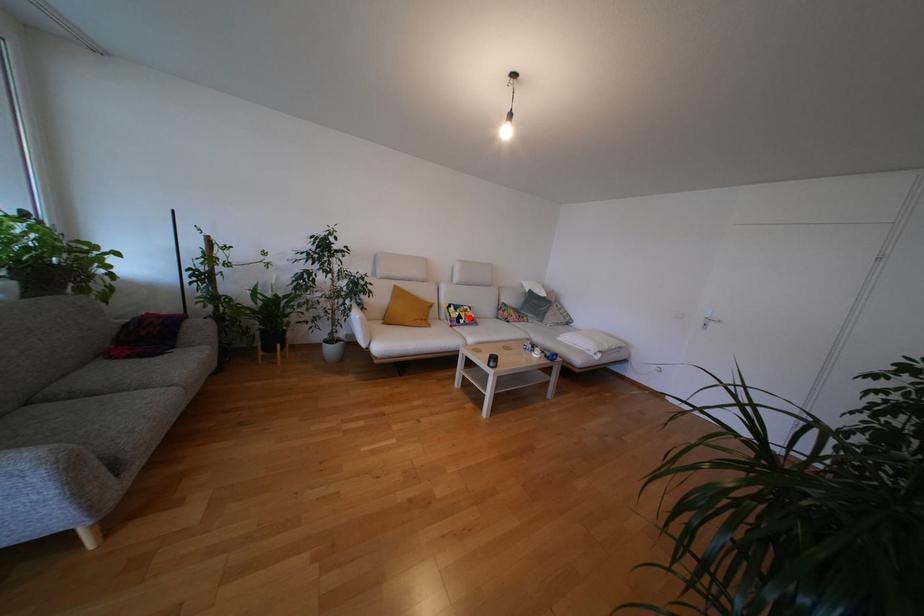
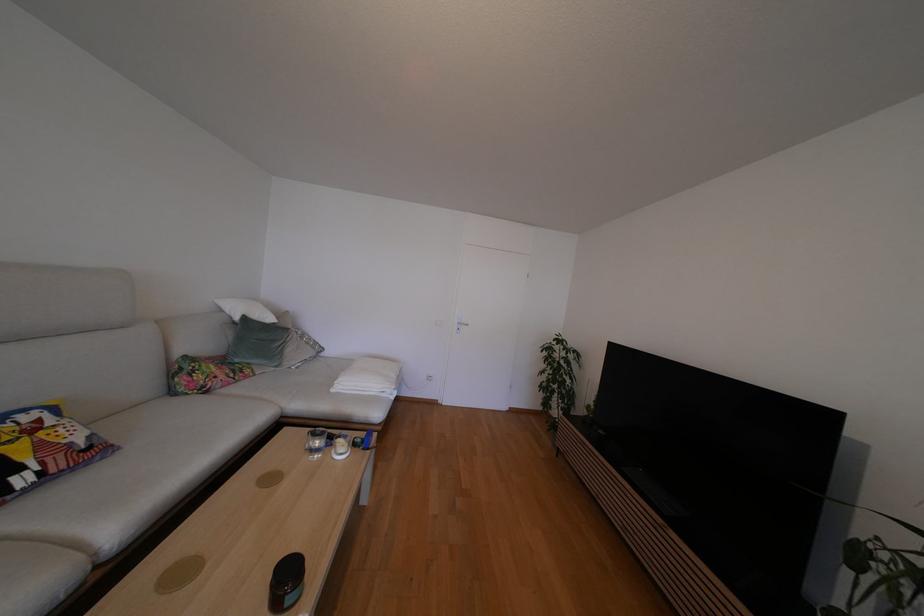
Question: A red point is marked in image1. In image2, is the corresponding 3D point closer to the camera or farther? Reply with the corresponding letter.

Choices:
 (A) The corresponding 3D point is closer.
 (B) The corresponding 3D point is farther.

Answer: (A)